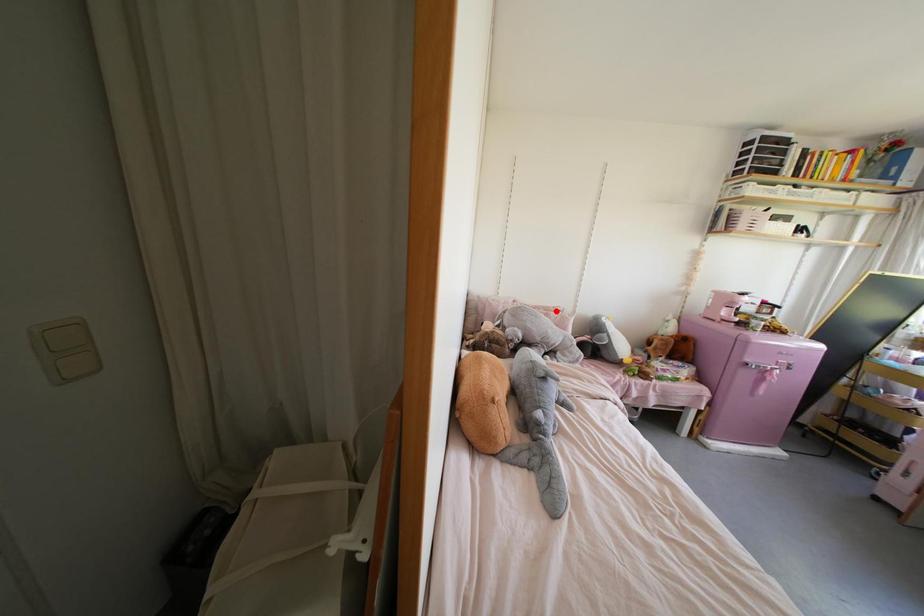
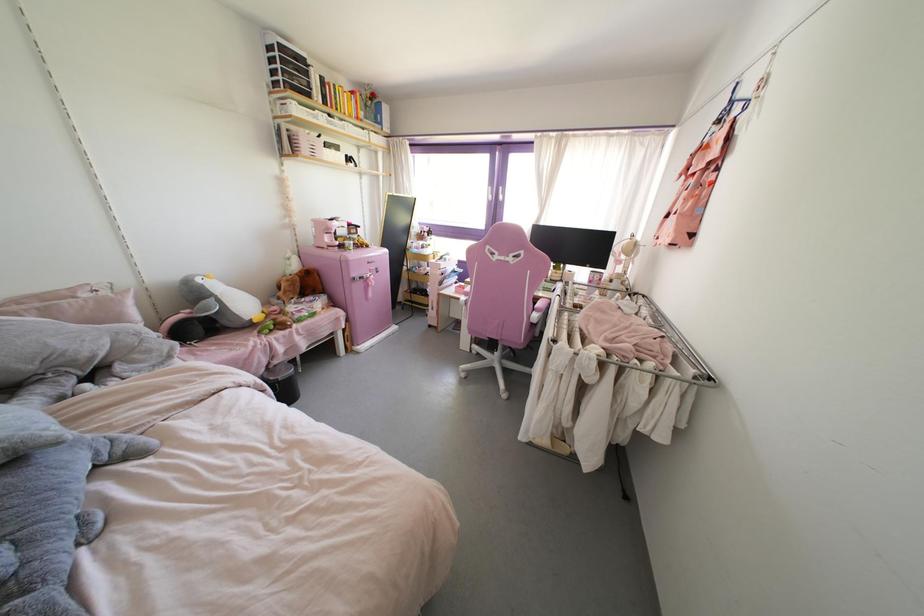
Where in the second image is the point corresponding to the highlighted location from the first image?

(83, 294)